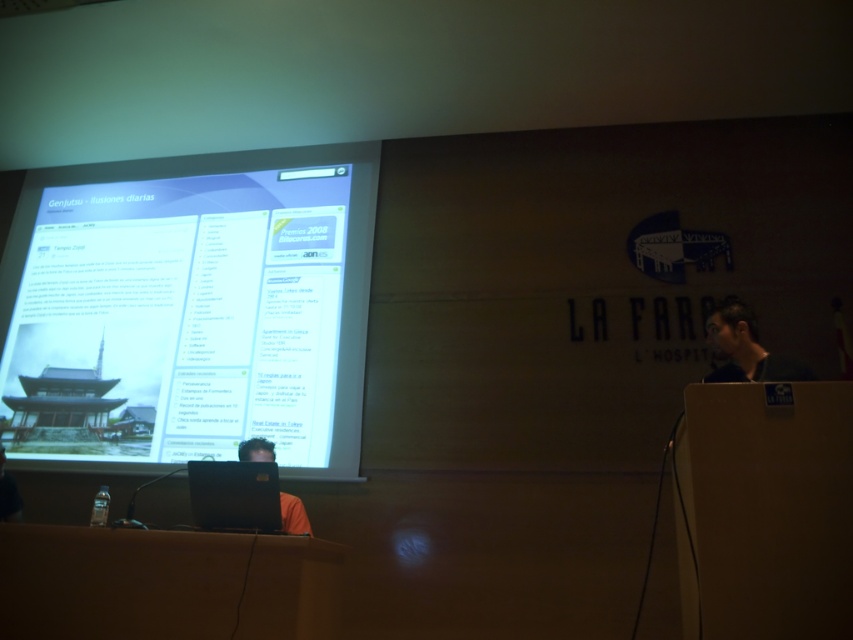
Question: Is white glossy projector screen at upper center to the right of matte black laptop at right from the viewer's perspective?

Choices:
 (A) yes
 (B) no

Answer: (B)

Question: Considering the real-world distances, which object is closest to the white glossy projector screen at upper center?

Choices:
 (A) black matte laptop at center
 (B) matte black laptop at center

Answer: (B)

Question: Which object appears farthest from the camera in this image?

Choices:
 (A) matte black laptop at center
 (B) black matte laptop at center
 (C) matte black laptop at right

Answer: (A)

Question: Does white glossy projector screen at upper center appear on the left side of black matte laptop at center?

Choices:
 (A) no
 (B) yes

Answer: (B)

Question: Which object is farther from the camera taking this photo?

Choices:
 (A) matte black laptop at right
 (B) black matte laptop at center

Answer: (A)

Question: Does white glossy projector screen at upper center come behind matte black laptop at right?

Choices:
 (A) yes
 (B) no

Answer: (A)